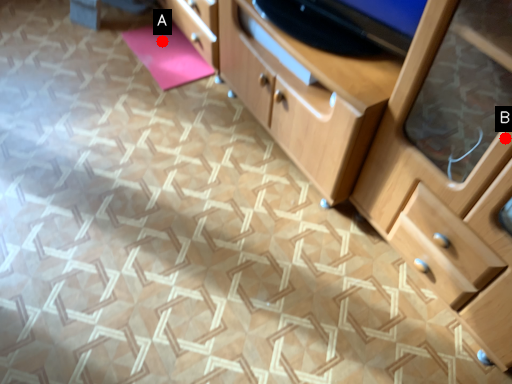
Question: Two points are circled on the image, labeled by A and B beside each circle. Among these points, which one is nearest to the camera?

Choices:
 (A) A is closer
 (B) B is closer

Answer: (B)